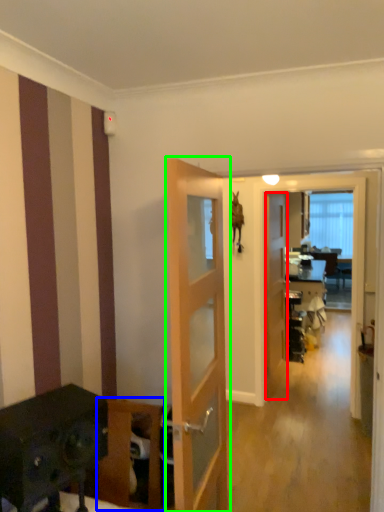
Question: Which is nearer to the door (highlighted by a red box)? furniture (highlighted by a blue box) or door (highlighted by a green box).

Choices:
 (A) furniture
 (B) door

Answer: (B)